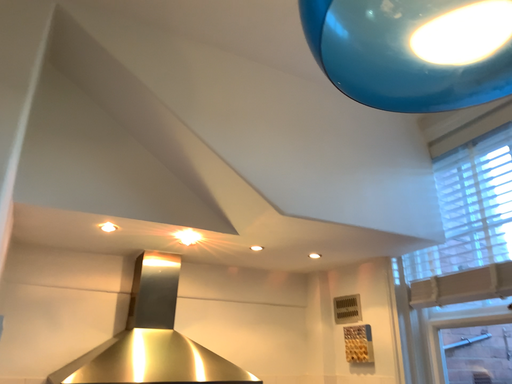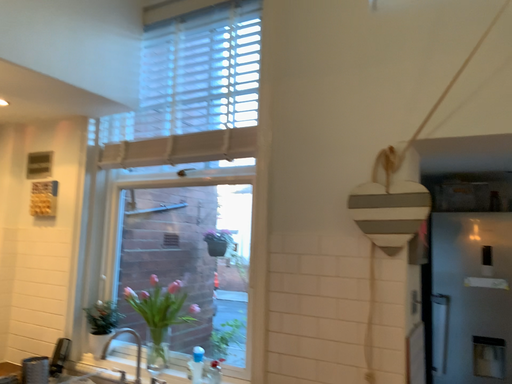
Question: How did the camera likely rotate when shooting the video?

Choices:
 (A) rotated left
 (B) rotated right

Answer: (B)